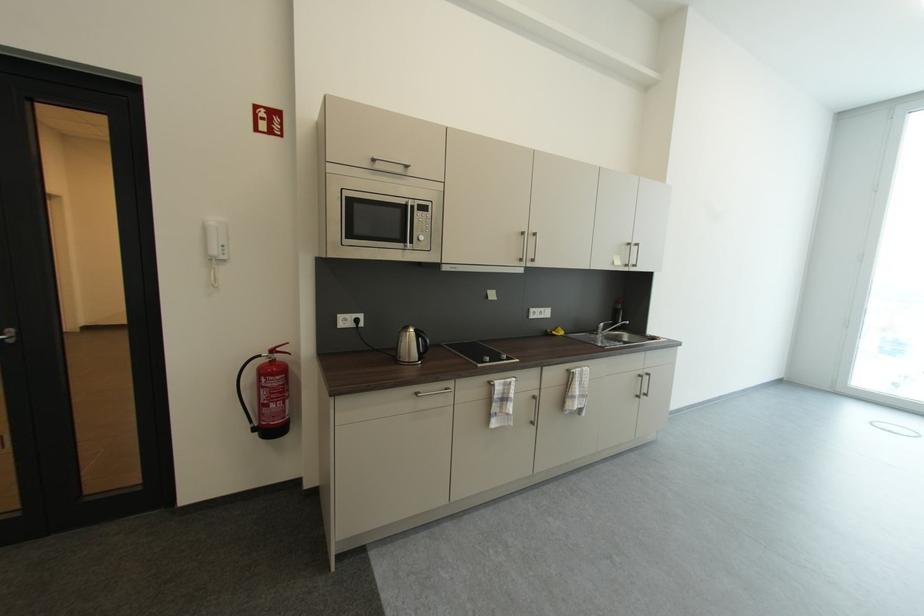
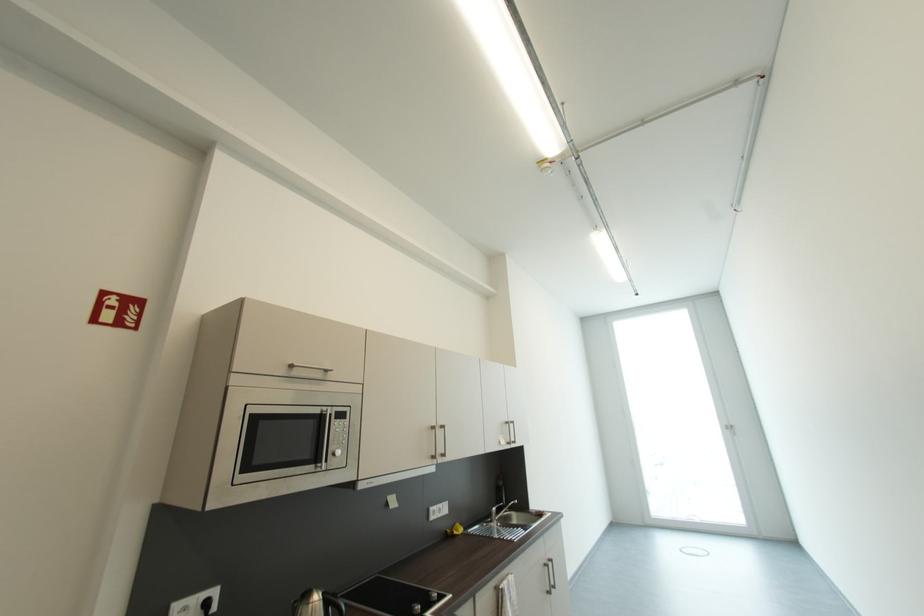
In the second image, find the point that corresponds to the point at 415,334 in the first image.

(317, 607)